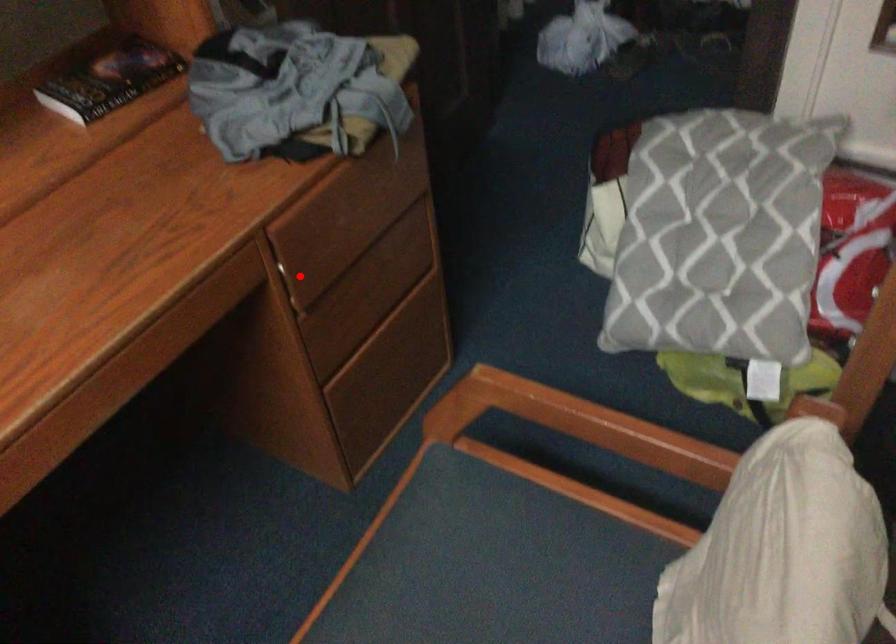
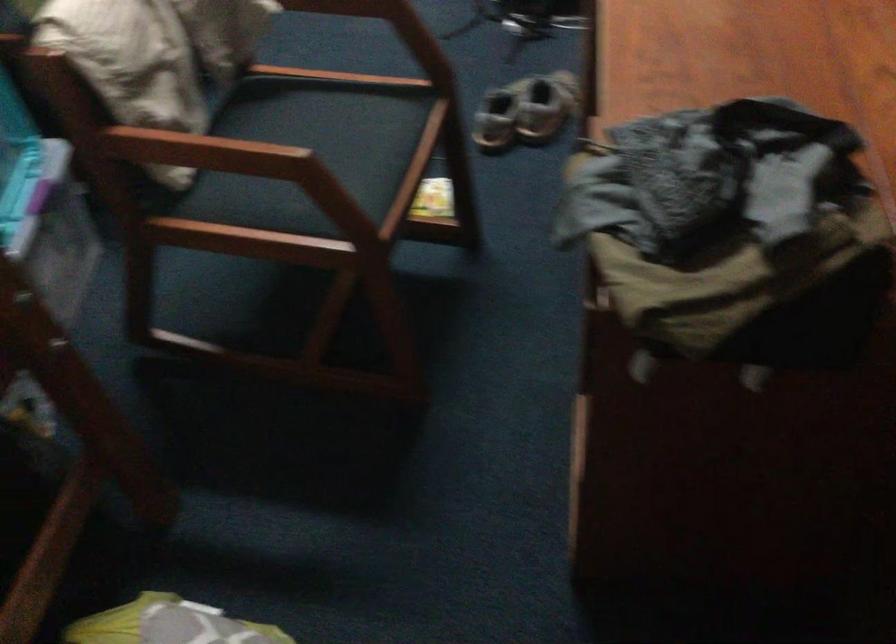
Question: I am providing you with two images of the same scene from different viewpoints. A red point is marked on the first image. Is the red point's position out of view in image 2?

Choices:
 (A) Yes
 (B) No

Answer: (A)